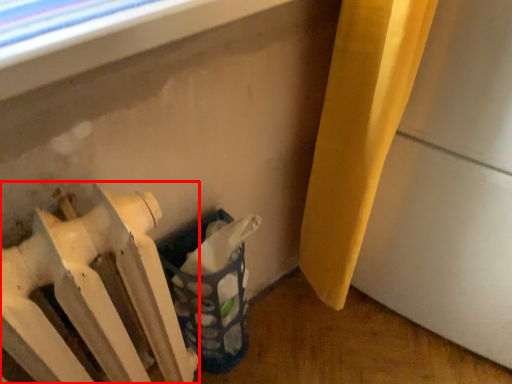
Question: In this image, where is radiator (annotated by the red box) located relative to laundry basket?

Choices:
 (A) left
 (B) right

Answer: (A)